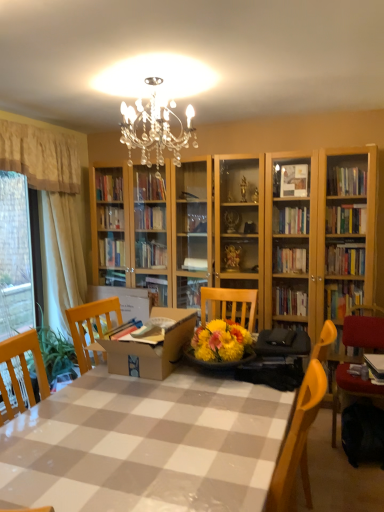
Question: Is beige fabric curtain at left, marked as the second curtain in a right-to-left arrangement, wider or thinner than beige fabric curtain at left, placed as the first curtain when sorted from right to left?

Choices:
 (A) thin
 (B) wide

Answer: (B)

Question: In terms of size, does beige fabric curtain at left, marked as the second curtain in a right-to-left arrangement, appear bigger or smaller than beige fabric curtain at left, the 3th curtain when ordered from left to right?

Choices:
 (A) big
 (B) small

Answer: (B)

Question: Estimate the real-world distances between objects in this image. Which object is farther from the velvet red chair at lower right?

Choices:
 (A) checkered plastic table at center
 (B) beige fabric curtain at left, placed as the first curtain when sorted from right to left
 (C) white sheer curtain at left, which is the third curtain from right to left
 (D) cardboard box at center
 (E) beige fabric curtain at left, marked as the 2th curtain in a left-to-right arrangement

Answer: (E)

Question: Estimate the real-world distances between objects in this image. Which object is closer to the white sheer curtain at left, acting as the first curtain starting from the left?

Choices:
 (A) velvet red chair at lower right
 (B) beige fabric curtain at left, marked as the second curtain in a right-to-left arrangement
 (C) beige fabric curtain at left, placed as the first curtain when sorted from right to left
 (D) cardboard box at center
 (E) checkered plastic table at center

Answer: (C)